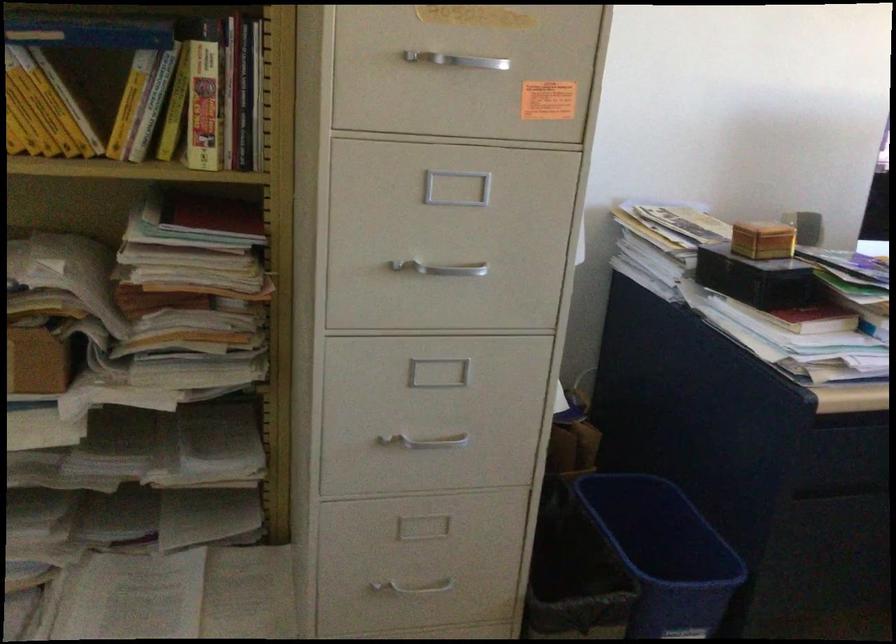
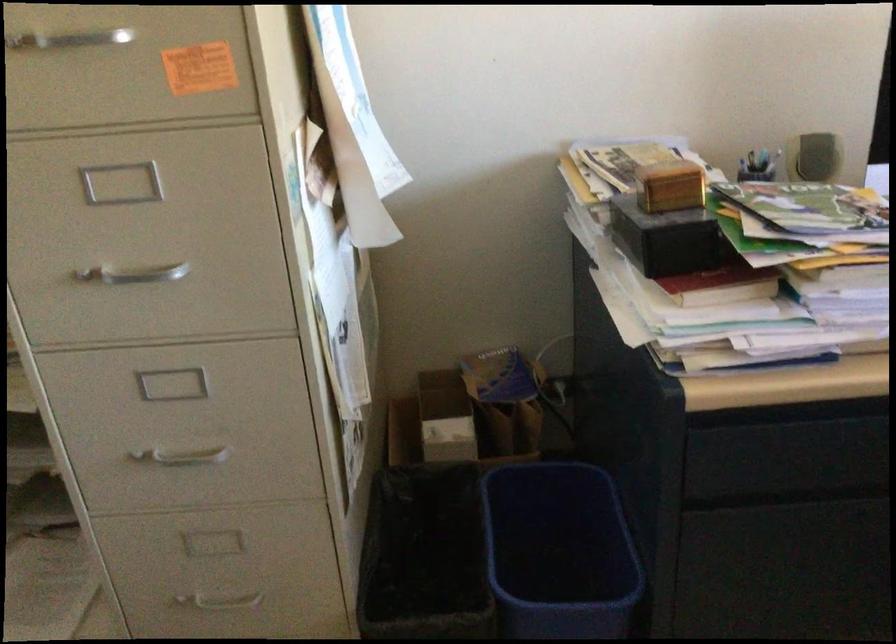
In the scene shown: What movement of the cameraman would produce the second image?

The movement direction of the cameraman is right, forward.